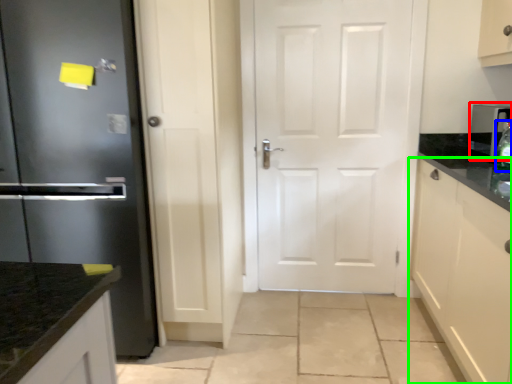
Question: Based on their relative distances, which object is farther from appliance (highlighted by a red box)? Choose from bottle (highlighted by a blue box) and cabinetry (highlighted by a green box).

Choices:
 (A) bottle
 (B) cabinetry

Answer: (B)